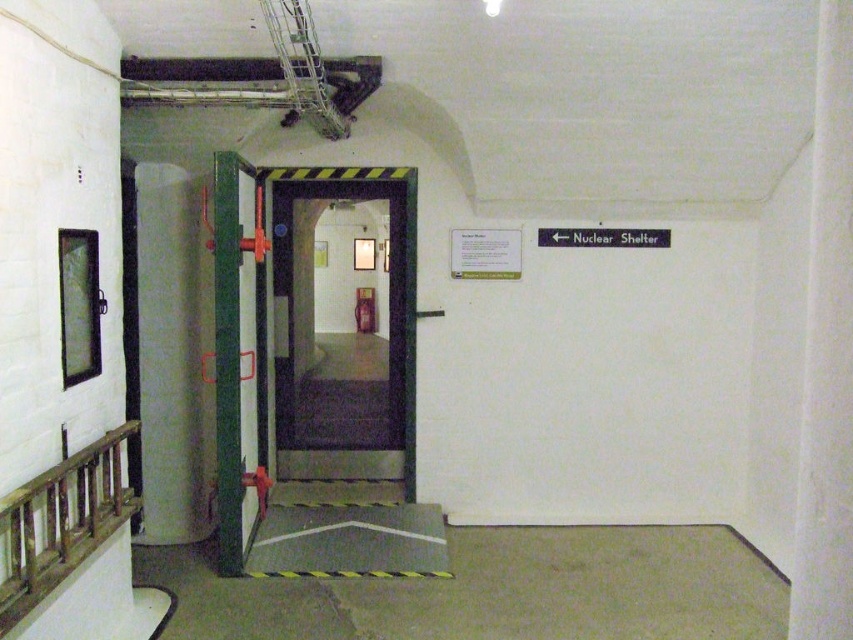
In the scene shown: Is green matte door at center positioned at the back of metallic door at center?

No, green matte door at center is in front of metallic door at center.

This screenshot has width=853, height=640. I want to click on green matte door at center, so click(x=236, y=355).

Which is more to the right, wooden at left or metallic door at center?

From the viewer's perspective, metallic door at center appears more on the right side.

Is wooden at left taller than metallic door at center?

No.

Is point (51, 557) positioned before point (404, 326)?

Yes, point (51, 557) is closer to viewer.

At what (x,y) coordinates should I click in order to perform the action: click on wooden at left. Please return your answer as a coordinate pair (x, y). The image size is (853, 640). Looking at the image, I should click on (61, 522).

Describe the element at coordinates (236, 355) in the screenshot. I see `green matte door at center` at that location.

Is point (239, 205) closer to camera compared to point (86, 534)?

No, (239, 205) is behind (86, 534).

Describe the element at coordinates (236, 355) in the screenshot. I see `green matte door at center` at that location.

This screenshot has width=853, height=640. What are the coordinates of `green matte door at center` in the screenshot? It's located at (236, 355).